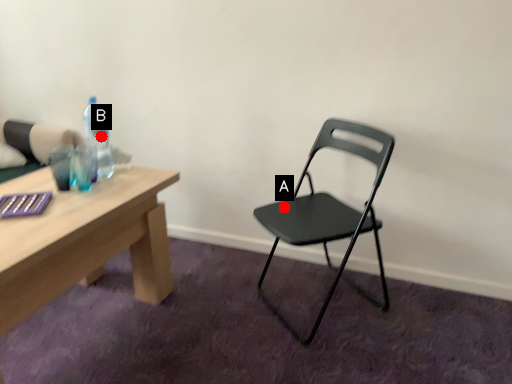
Question: Two points are circled on the image, labeled by A and B beside each circle. Which point appears farthest from the camera in this image?

Choices:
 (A) A is further
 (B) B is further

Answer: (B)